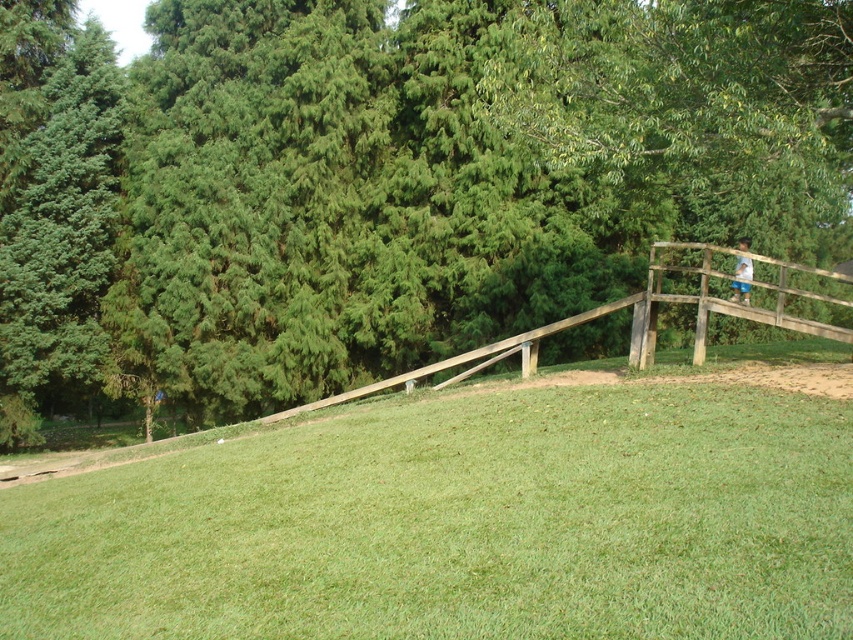
Does point (165, 609) come farther from viewer compared to point (415, 372)?

No, (165, 609) is in front of (415, 372).

How much distance is there between green grassy at center and wooden rail at right?

green grassy at center and wooden rail at right are 5.76 meters apart.

Who is more distant from viewer, (589, 416) or (392, 376)?

Positioned behind is point (392, 376).

Locate an element on the screen. green grassy at center is located at coordinates (459, 524).

The height and width of the screenshot is (640, 853). What do you see at coordinates (459, 524) in the screenshot?
I see `green grassy at center` at bounding box center [459, 524].

The image size is (853, 640). What are the coordinates of `green grassy at center` in the screenshot? It's located at (459, 524).

Does green leafy tree at upper center have a greater height compared to wooden rail at right?

Yes, green leafy tree at upper center is taller than wooden rail at right.

Does green leafy tree at upper center appear under wooden rail at right?

No, green leafy tree at upper center is not below wooden rail at right.

Describe the element at coordinates (381, 182) in the screenshot. I see `green leafy tree at upper center` at that location.

Identify the location of green leafy tree at upper center. The width and height of the screenshot is (853, 640). (381, 182).